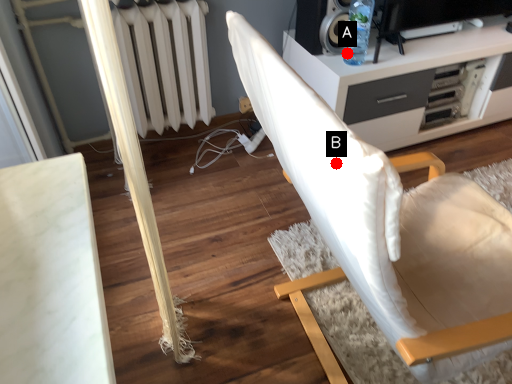
Question: Two points are circled on the image, labeled by A and B beside each circle. Among these points, which one is farthest from the camera?

Choices:
 (A) A is further
 (B) B is further

Answer: (A)